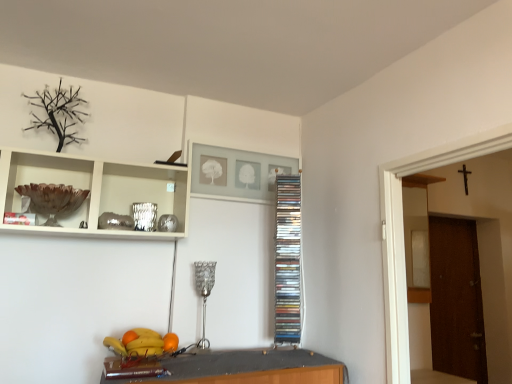
Question: Is silver metallic lamp at center to the left or to the right of brown glass bowl at upper left, positioned as the 2th cabinet in back-to-front order, in the image?

Choices:
 (A) right
 (B) left

Answer: (A)

Question: Is silver metallic lamp at center taller or shorter than brown glass bowl at upper left, positioned as the 2th cabinet in back-to-front order?

Choices:
 (A) tall
 (B) short

Answer: (A)

Question: Which of these objects is positioned farthest from the clear plastic cd rack at center, positioned as the 2th cabinet in front-to-back order?

Choices:
 (A) orange matte at lower center, marked as the first orange in a left-to-right arrangement
 (B) brown textured door at right
 (C) silver metallic lamp at center
 (D) brown glass bowl at upper left, positioned as the 2th cabinet in back-to-front order
 (E) shiny plastic bowl at lower center

Answer: (B)

Question: Which object is positioned closest to the clear plastic cd rack at center, which is the first cabinet from back to front?

Choices:
 (A) orange matte at lower center, arranged as the 2th orange when viewed from the right
 (B) silver metallic lamp at center
 (C) brown glass bowl at upper left, the first cabinet when ordered from front to back
 (D) orange matte at lower center, the first orange positioned from the right
 (E) brown textured door at right

Answer: (B)